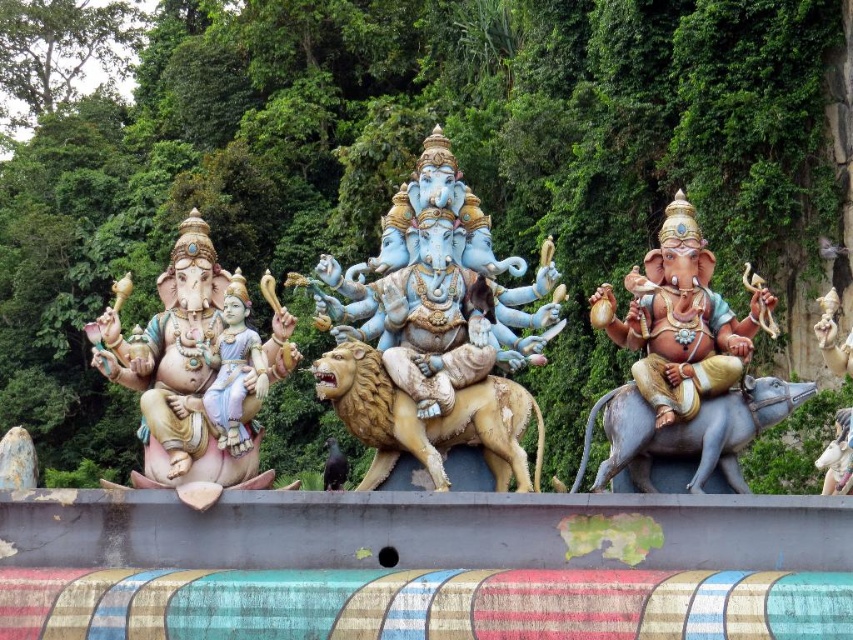
Who is positioned more to the left, blue glossy statue at center or matte pink statue at left?

matte pink statue at left

Who is positioned more to the right, blue glossy statue at center or matte pink statue at left?

blue glossy statue at center

Locate an element on the screen. The image size is (853, 640). blue glossy statue at center is located at coordinates (438, 291).

Identify the location of blue glossy statue at center. The height and width of the screenshot is (640, 853). (438, 291).

Is point (111, 320) farther from viewer compared to point (329, 483)?

That is False.

Does matte pink statue at left have a lesser width compared to shiny golden lion at center?

In fact, matte pink statue at left might be wider than shiny golden lion at center.

The height and width of the screenshot is (640, 853). What do you see at coordinates (190, 374) in the screenshot?
I see `matte pink statue at left` at bounding box center [190, 374].

Where is `matte pink statue at left`? matte pink statue at left is located at coordinates (190, 374).

Who is higher up, blue glossy statue at center or matte gold elephant at right?

blue glossy statue at center is above.

From the picture: Is blue glossy statue at center above matte gold elephant at right?

Yes, blue glossy statue at center is above matte gold elephant at right.

Is point (427, 305) in front of point (664, 372)?

No.

You are a GUI agent. You are given a task and a screenshot of the screen. Output one action in this format:
    pyautogui.click(x=<x>, y=<y>)
    Task: Click on the blue glossy statue at center
    Image resolution: width=853 pixels, height=640 pixels.
    Given the screenshot: What is the action you would take?
    pyautogui.click(x=438, y=291)